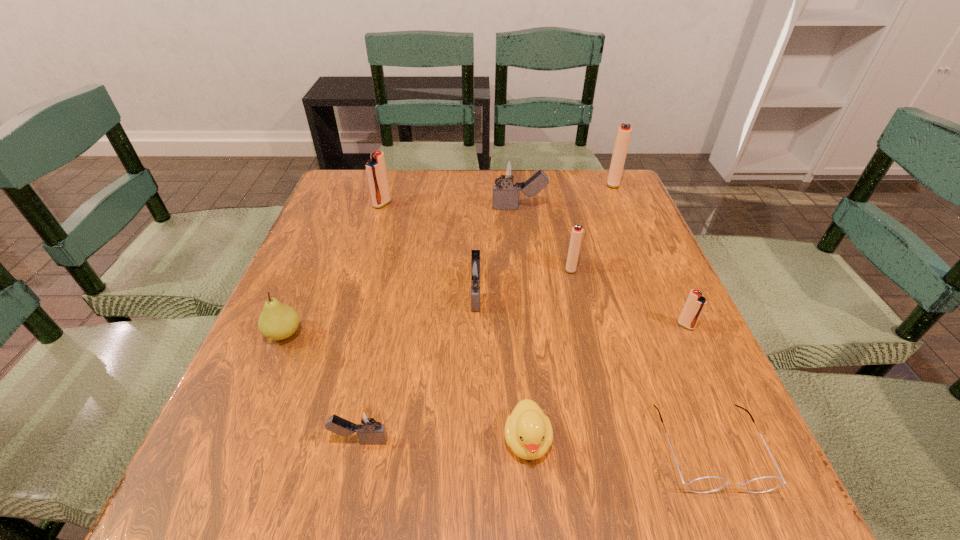
Find the location of a particular element. vacant space at the far left corner is located at coordinates (348, 185).

The height and width of the screenshot is (540, 960). What are the coordinates of `vacant space at the far right corner` in the screenshot? It's located at (605, 196).

You are a GUI agent. You are given a task and a screenshot of the screen. Output one action in this format:
    pyautogui.click(x=<x>, y=<y>)
    Task: Click on the vacant region at the near right corner of the desktop
    
    Given the screenshot: What is the action you would take?
    coord(750,471)

Find the location of `vacant space that's between the third object from left to right and the tallest igniter`. vacant space that's between the third object from left to right and the tallest igniter is located at coordinates (487, 312).

This screenshot has height=540, width=960. What are the coordinates of `vacant space that is in between the rightmost gray igniter and the leftmost igniter` in the screenshot? It's located at (450, 206).

You are a GUI agent. You are given a task and a screenshot of the screen. Output one action in this format:
    pyautogui.click(x=<x>, y=<y>)
    Task: Click on the free area in between the sixth farthest igniter and the second red igniter from left to right
    The width and height of the screenshot is (960, 540).
    Given the screenshot: What is the action you would take?
    pyautogui.click(x=629, y=296)

The image size is (960, 540). Identify the location of free space that is in between the farthest gray igniter and the tallest object. (566, 195).

Locate an element on the screen. The width and height of the screenshot is (960, 540). empty space between the fourth igniter from right to left and the sixth farthest igniter is located at coordinates (603, 267).

I want to click on vacant area between the green pear and the tallest igniter, so click(448, 258).

Find the location of a particular element. Image resolution: width=960 pixels, height=540 pixels. vacant space in between the tallest object and the duckling is located at coordinates (570, 312).